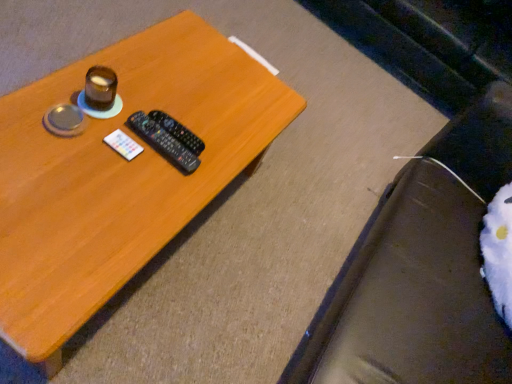
This screenshot has width=512, height=384. I want to click on vacant area that is in front of shiny brown cup at upper left, so click(x=53, y=146).